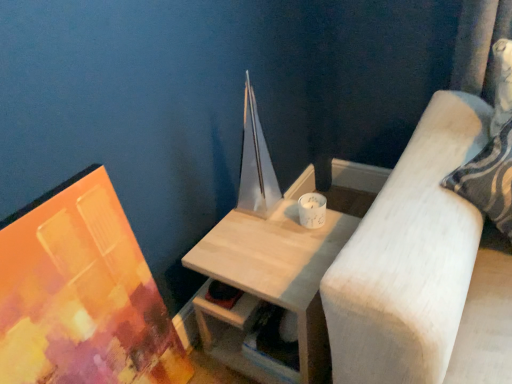
Where is `empty space that is ontop of light wood table at center (from a real-world perspective)`? The height and width of the screenshot is (384, 512). empty space that is ontop of light wood table at center (from a real-world perspective) is located at coordinates (267, 245).